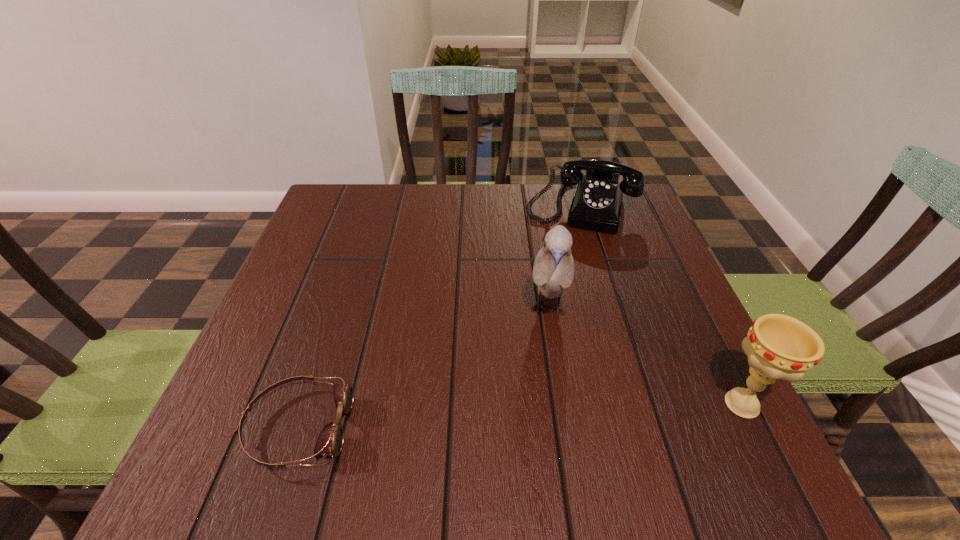
You are a GUI agent. You are given a task and a screenshot of the screen. Output one action in this format:
    pyautogui.click(x=<x>, y=<y>)
    Task: Click on the goggles
    Image resolution: width=960 pixels, height=540 pixels.
    Given the screenshot: What is the action you would take?
    pyautogui.click(x=330, y=440)

Locate an element on the screen. This screenshot has width=960, height=540. the leftmost object is located at coordinates click(330, 440).

This screenshot has width=960, height=540. I want to click on chalice, so click(778, 346).

You are a GUI agent. You are given a task and a screenshot of the screen. Output one action in this format:
    pyautogui.click(x=<x>, y=<y>)
    Task: Click on the third nearest object
    
    Given the screenshot: What is the action you would take?
    pyautogui.click(x=553, y=271)

Locate an element on the screen. This screenshot has width=960, height=540. bird is located at coordinates (553, 271).

This screenshot has height=540, width=960. In order to click on telephone in this screenshot , I will do `click(597, 201)`.

Identify the location of the farthest object. The width and height of the screenshot is (960, 540). (597, 201).

Locate an element on the screen. This screenshot has width=960, height=540. vacant space located 0.100m through the lenses of the leftmost object is located at coordinates (409, 427).

At what (x,y) coordinates should I click in order to perform the action: click on vacant space situated 0.380m on the left of the chalice. Please return your answer as a coordinate pair (x, y). Looking at the image, I should click on (493, 404).

Identify the location of free space located at the beak of the tallest object. (544, 418).